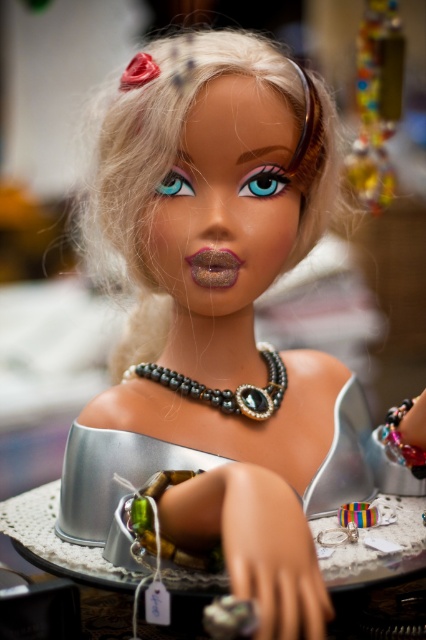
Question: Where is multicolored beaded necklace at upper right located in relation to pearl and glass beads necklace at center in the image?

Choices:
 (A) left
 (B) right

Answer: (B)

Question: Does multicolored beaded necklace at upper right appear under pearl and glass beads necklace at center?

Choices:
 (A) yes
 (B) no

Answer: (B)

Question: Which of the following is the closest to the observer?

Choices:
 (A) (347, 164)
 (B) (273, 392)

Answer: (B)

Question: Does multicolored beaded necklace at upper right have a smaller size compared to pearl and glass beads necklace at center?

Choices:
 (A) no
 (B) yes

Answer: (A)

Question: Which point appears farthest from the camera in this image?

Choices:
 (A) (229, 396)
 (B) (391, 188)

Answer: (B)

Question: Which point appears closest to the camera in this image?

Choices:
 (A) coord(383,108)
 (B) coord(163,385)

Answer: (B)